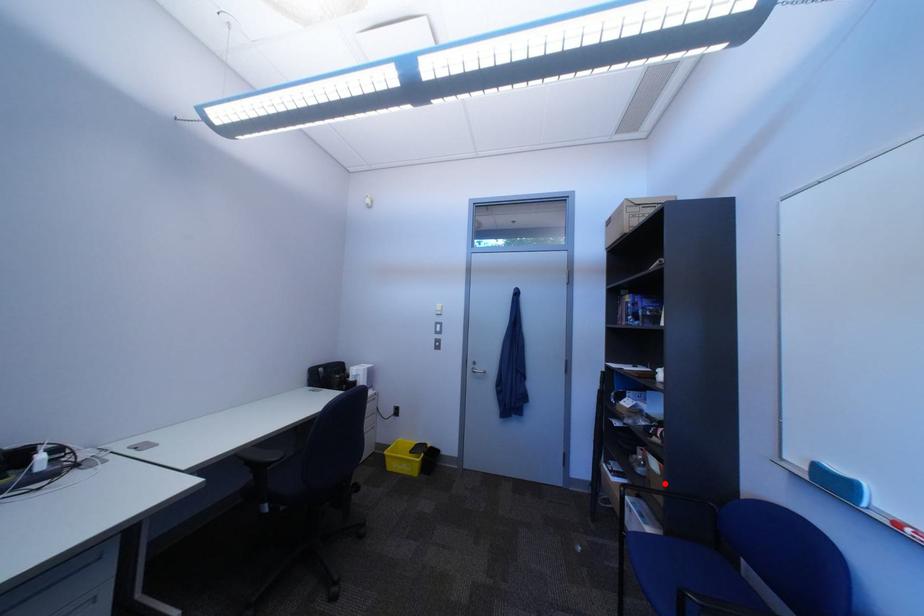
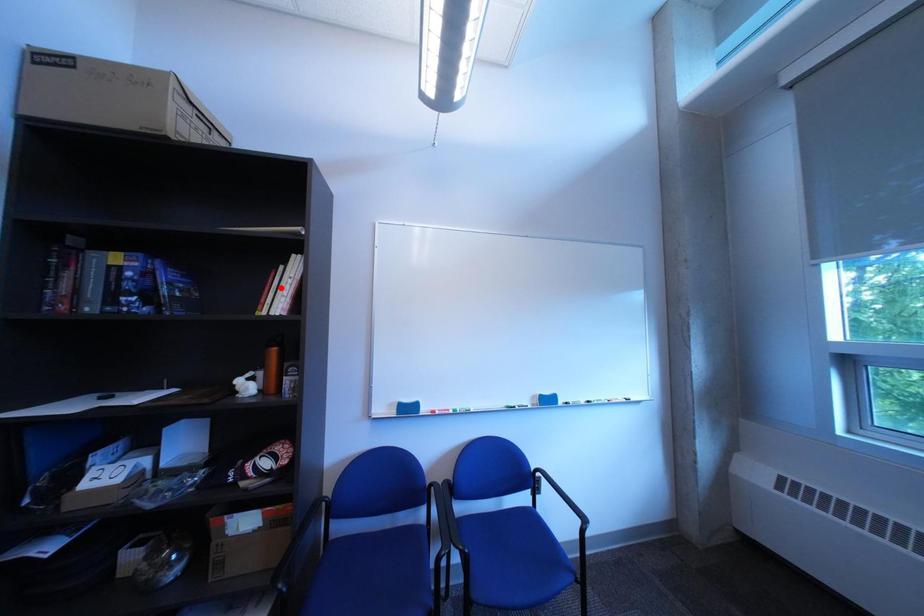
I am providing you with two images of the same scene from different viewpoints. A red point is marked on the first image and another point is marked on the second image. Is the marked point in image1 the same physical position as the marked point in image2?

No